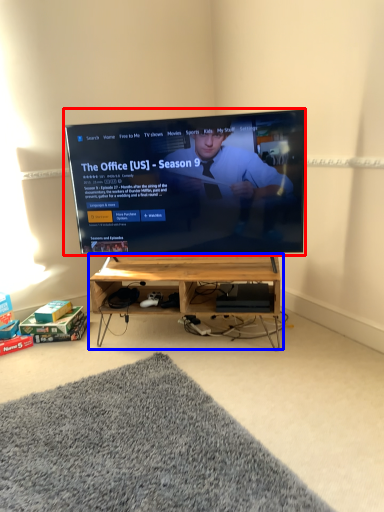
Question: Which object is closer to the camera taking this photo, television (highlighted by a red box) or shelf (highlighted by a blue box)?

Choices:
 (A) television
 (B) shelf

Answer: (A)